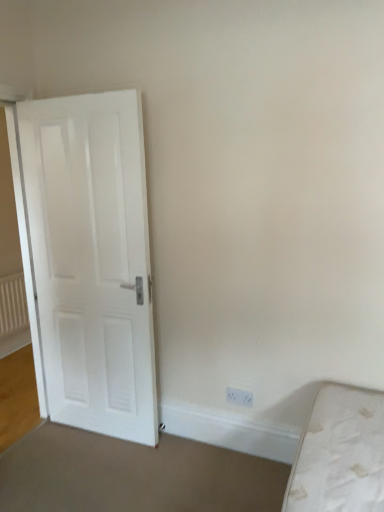
Measure the distance between point (x=22, y=286) and camera.

A distance of 3.87 meters exists between point (x=22, y=286) and camera.

I want to click on white matte door at left, so click(x=92, y=260).

Considering the relative positions of white matte door at left and white textured radiator at left in the image provided, is white matte door at left to the left or to the right of white textured radiator at left?

In the image, white matte door at left appears on the right side of white textured radiator at left.

Image resolution: width=384 pixels, height=512 pixels. Find the location of `radiator that is below the white matte door at left (from the image's perspective)`. radiator that is below the white matte door at left (from the image's perspective) is located at coordinates (13, 305).

Considering the sizes of white matte door at left and white textured radiator at left in the image, is white matte door at left taller or shorter than white textured radiator at left?

In the image, white matte door at left appears to be taller than white textured radiator at left.

Considering the positions of points (126, 375) and (18, 311), is point (126, 375) closer to camera compared to point (18, 311)?

Yes, point (126, 375) is in front of point (18, 311).

Locate an element on the screen. This screenshot has height=512, width=384. radiator above the white plastic electric outlet at lower right (from the image's perspective) is located at coordinates (13, 305).

Considering the positions of point (242, 391) and point (17, 328), is point (242, 391) closer or farther from the camera than point (17, 328)?

Point (242, 391).

Is white plastic electric outlet at lower right in contact with white textured radiator at left?

white plastic electric outlet at lower right and white textured radiator at left are not in contact.

From a real-world perspective, who is located lower, white plastic electric outlet at lower right or white textured radiator at left?

white plastic electric outlet at lower right, from a real-world perspective.

Is white plastic electric outlet at lower right at the back of white matte door at left?

white matte door at left does not have its back to white plastic electric outlet at lower right.

From a real-world perspective, who is located higher, white matte door at left or white plastic electric outlet at lower right?

white matte door at left.

Which of these two, white matte door at left or white plastic electric outlet at lower right, stands shorter?

Standing shorter between the two is white plastic electric outlet at lower right.

Relative to white plastic electric outlet at lower right, is white matte door at left in front or behind?

Clearly, white matte door at left is in front of white plastic electric outlet at lower right.

Considering the relative positions of white textured radiator at left and white plastic electric outlet at lower right in the image provided, is white textured radiator at left to the left of white plastic electric outlet at lower right from the viewer's perspective?

Correct, you'll find white textured radiator at left to the left of white plastic electric outlet at lower right.

Locate an element on the screen. The height and width of the screenshot is (512, 384). radiator that appears above the white plastic electric outlet at lower right (from a real-world perspective) is located at coordinates (13, 305).

From a real-world perspective, does white textured radiator at left sit lower than white plastic electric outlet at lower right?

Incorrect, from a real-world perspective, white textured radiator at left is higher than white plastic electric outlet at lower right.

Based on the photo, is the depth of white textured radiator at left less than that of white plastic electric outlet at lower right?

No, it is behind white plastic electric outlet at lower right.

Is white plastic electric outlet at lower right bigger or smaller than white matte door at left?

white plastic electric outlet at lower right is smaller than white matte door at left.

Which object is further away from the camera, white plastic electric outlet at lower right or white matte door at left?

white plastic electric outlet at lower right is further from the camera.

Is white plastic electric outlet at lower right completely or partially outside of white matte door at left?

That's correct, white plastic electric outlet at lower right is outside of white matte door at left.

In the scene shown: Can you confirm if white textured radiator at left is bigger than white matte door at left?

No.

Can you tell me how much white textured radiator at left and white matte door at left differ in facing direction?

88.8 degrees separate the facing orientations of white textured radiator at left and white matte door at left.

From a real-world perspective, which object stands above the other?

white matte door at left, from a real-world perspective.

In the scene shown: Between white textured radiator at left and white matte door at left, which one appears on the right side from the viewer's perspective?

Positioned to the right is white matte door at left.

You are a GUI agent. You are given a task and a screenshot of the screen. Output one action in this format:
    pyautogui.click(x=<x>, y=<y>)
    Task: Click on the door above the white textured radiator at left (from the image's perspective)
    
    Given the screenshot: What is the action you would take?
    pyautogui.click(x=92, y=260)

Locate an element on the screen. The height and width of the screenshot is (512, 384). electric outlet that is on the right side of white textured radiator at left is located at coordinates tap(239, 397).

Estimate the real-world distances between objects in this image. Which object is closer to white matte door at left, white textured radiator at left or white plastic electric outlet at lower right?

Based on the image, white plastic electric outlet at lower right appears to be nearer to white matte door at left.

Based on their spatial positions, is white plastic electric outlet at lower right or white textured radiator at left closer to white matte door at left?

white plastic electric outlet at lower right lies closer to white matte door at left than the other object.

Which object lies nearer to the anchor point white plastic electric outlet at lower right, white textured radiator at left or white matte door at left?

Based on the image, white matte door at left appears to be nearer to white plastic electric outlet at lower right.

Looking at the image, which one is located further to white textured radiator at left, white matte door at left or white plastic electric outlet at lower right?

white plastic electric outlet at lower right lies further to white textured radiator at left than the other object.

Considering their positions, is white plastic electric outlet at lower right positioned closer to white textured radiator at left than white matte door at left?

Among the two, white matte door at left is located nearer to white textured radiator at left.

Based on their spatial positions, is white matte door at left or white textured radiator at left further from white plastic electric outlet at lower right?

Based on the image, white textured radiator at left appears to be further to white plastic electric outlet at lower right.

Find the location of a particular element. Image resolution: width=384 pixels, height=512 pixels. door between white textured radiator at left and white plastic electric outlet at lower right in the horizontal direction is located at coordinates (92, 260).